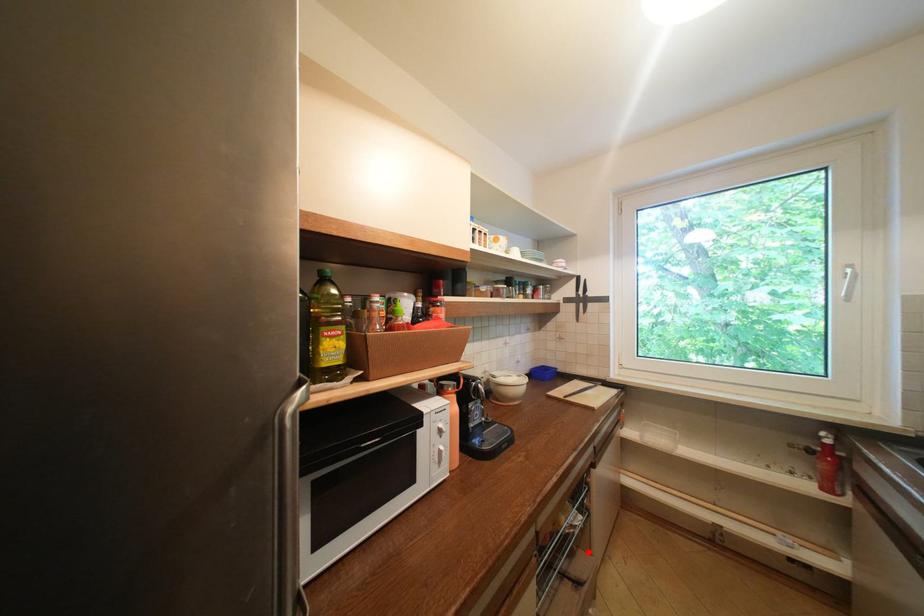
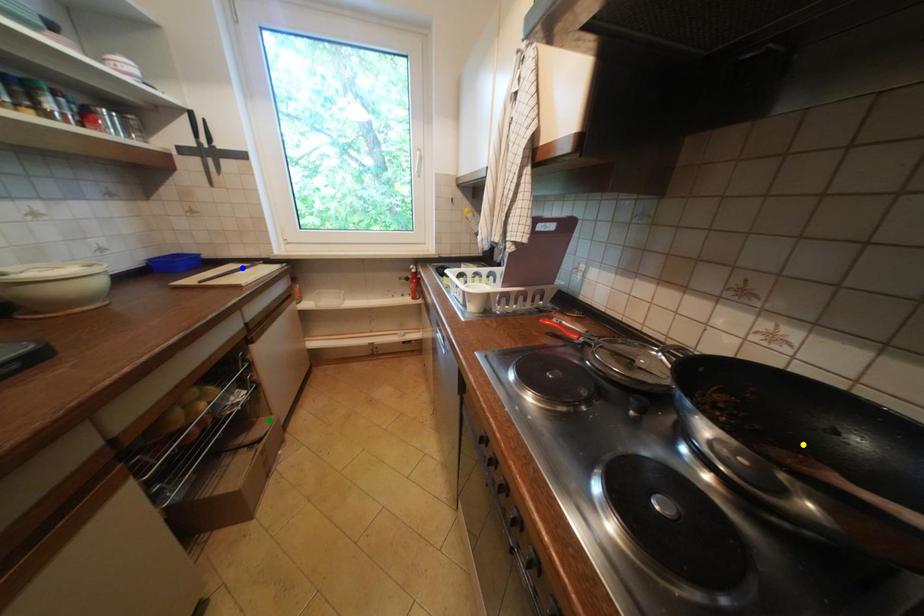
Question: I am providing you with two images of the same scene from different viewpoints. A red point is marked on the first image. You are given multiple points on the second image. Which mark in image 2 goes with the point in image 1?

Choices:
 (A) blue point
 (B) yellow point
 (C) green point

Answer: (C)